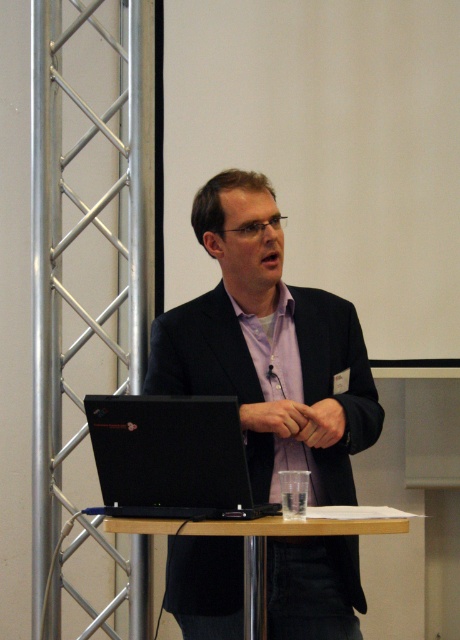
You are a photographer setting up for a presentation. You need to ensure that the matte black suit at center and the black matte laptop at center are both visible in your shot. Based on their positions, which object is covering part of the other?

The matte black suit at center is positioned over the black matte laptop at center, so the suit is covering part of the laptop.

You are a photographer positioned in front of the podium. You want to take a photo of the black matte laptop at center without including the matte black suit at center in the frame. Is this possible given their positions?

The matte black suit at center is further to the viewer than the black matte laptop at center, so the suit is closer to the photographer. This means the laptop is behind the suit, making it impossible to capture the laptop without the suit in the frame.

You are attending a lecture and need to reach the black matte laptop at center on the podium to adjust the presentation. Considering the distance between you and the laptop, can you comfortably walk to it without needing to move too far?

The black matte laptop at center is 6.37 feet away from the viewer. This distance is within a comfortable range for walking to adjust the laptop without needing to move too far.